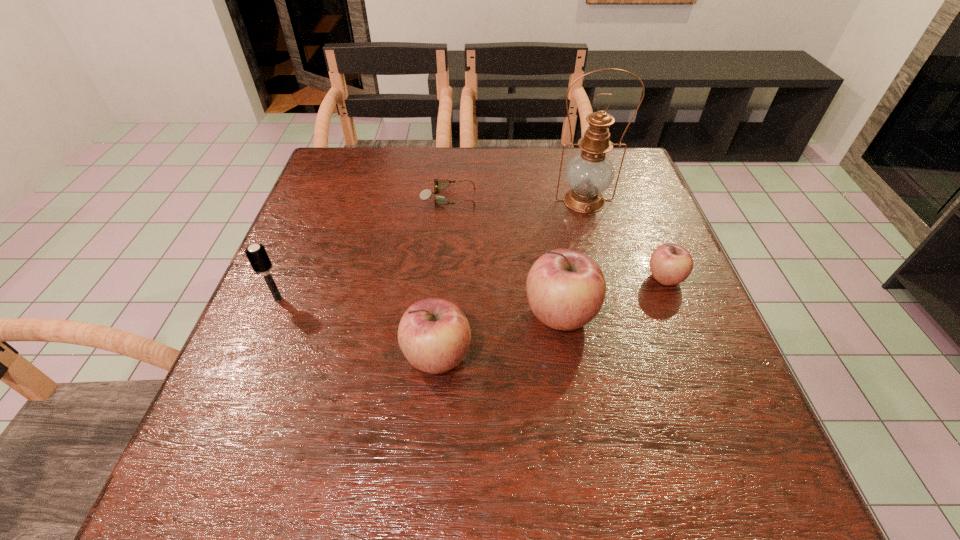
You are a GUI agent. You are given a task and a screenshot of the screen. Output one action in this format:
    pyautogui.click(x=<x>, y=<y>)
    Task: Click on the free point that satisfies the following two spatial constraints: 1. on the front-facing side of the shortest object; 2. on the left side of the tallest object
    
    Given the screenshot: What is the action you would take?
    pyautogui.click(x=448, y=201)

In order to click on free space that satisfies the following two spatial constraints: 1. on the back side of the second tallest apple; 2. on the right side of the second apple from right to left in this screenshot , I will do `click(441, 315)`.

At what (x,y) coordinates should I click in order to perform the action: click on vacant point that satisfies the following two spatial constraints: 1. on the front-facing side of the second apple from right to left; 2. on the right side of the shortest object. Please return your answer as a coordinate pair (x, y). The image size is (960, 540). Looking at the image, I should click on (439, 315).

What are the coordinates of `free space that satisfies the following two spatial constraints: 1. on the front side of the rightmost object; 2. on the left side of the tallest object` in the screenshot? It's located at (606, 279).